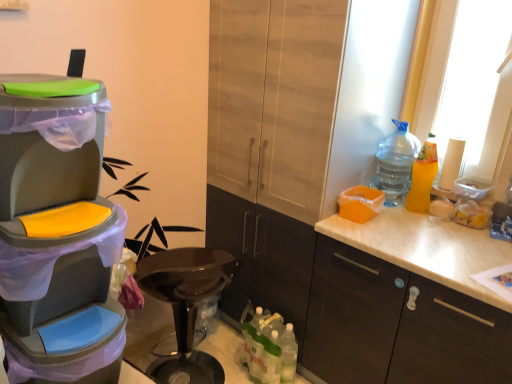
Question: Is matte wood cabinet at center, which is the 1th cabinetry in left-to-right order, turned away from white matte cabinet at right, arranged as the 1th cabinetry when viewed from the right?

Choices:
 (A) no
 (B) yes

Answer: (A)

Question: Is matte wood cabinet at center, which is the 2th cabinetry in right-to-left order, at the left side of white matte cabinet at right, which is the second cabinetry from left to right?

Choices:
 (A) no
 (B) yes

Answer: (B)

Question: Can you confirm if matte wood cabinet at center, which is the 1th cabinetry in left-to-right order, is taller than white matte cabinet at right, which is the second cabinetry from left to right?

Choices:
 (A) yes
 (B) no

Answer: (A)

Question: Considering the relative sizes of matte wood cabinet at center, which is the 2th cabinetry in right-to-left order, and white matte cabinet at right, which is the second cabinetry from left to right, in the image provided, is matte wood cabinet at center, which is the 2th cabinetry in right-to-left order, wider than white matte cabinet at right, which is the second cabinetry from left to right,?

Choices:
 (A) yes
 (B) no

Answer: (A)

Question: Considering the relative positions of matte wood cabinet at center, which is the 2th cabinetry in right-to-left order, and white matte cabinet at right, which is the second cabinetry from left to right, in the image provided, is matte wood cabinet at center, which is the 2th cabinetry in right-to-left order, to the right of white matte cabinet at right, which is the second cabinetry from left to right, from the viewer's perspective?

Choices:
 (A) no
 (B) yes

Answer: (A)

Question: From a real-world perspective, relative to white matte cabinet at right, arranged as the 1th cabinetry when viewed from the right, is translucent plastic bottles at lower center, which is the 1th bottle from bottom to top, vertically above or below?

Choices:
 (A) above
 (B) below

Answer: (B)

Question: Is point (272, 319) positioned closer to the camera than point (317, 340)?

Choices:
 (A) farther
 (B) closer

Answer: (A)

Question: Based on their positions, is translucent plastic bottles at lower center, which appears as the third bottle when viewed from the top, located to the left or right of white matte cabinet at right, which is the second cabinetry from left to right?

Choices:
 (A) right
 (B) left

Answer: (B)

Question: Is translucent plastic bottles at lower center, which appears as the third bottle when viewed from the top, spatially inside white matte cabinet at right, arranged as the 1th cabinetry when viewed from the right, or outside of it?

Choices:
 (A) inside
 (B) outside

Answer: (B)

Question: From their relative heights in the image, would you say white matte cabinet at right, which is the second cabinetry from left to right, is taller or shorter than yellow matte bottle at right, which is the 1th bottle in right-to-left order?

Choices:
 (A) tall
 (B) short

Answer: (A)

Question: Considering the positions of point (477, 369) and point (415, 195), is point (477, 369) closer or farther from the camera than point (415, 195)?

Choices:
 (A) closer
 (B) farther

Answer: (A)

Question: Considering their positions, is white matte cabinet at right, arranged as the 1th cabinetry when viewed from the right, located in front of or behind yellow matte bottle at right, which is the 1th bottle in right-to-left order?

Choices:
 (A) front
 (B) behind

Answer: (A)

Question: From a real-world perspective, is white matte cabinet at right, arranged as the 1th cabinetry when viewed from the right, above or below yellow matte bottle at right, the 2th bottle in the bottom-to-top sequence?

Choices:
 (A) above
 (B) below

Answer: (B)

Question: Looking at the image, does matte wood cabinet at center, which is the 1th cabinetry in left-to-right order, seem bigger or smaller compared to yellow matte bottle at right, the third bottle positioned from the left?

Choices:
 (A) big
 (B) small

Answer: (A)

Question: From the image's perspective, is matte wood cabinet at center, which is the 2th cabinetry in right-to-left order, positioned above or below yellow matte bottle at right, the third bottle positioned from the left?

Choices:
 (A) above
 (B) below

Answer: (A)